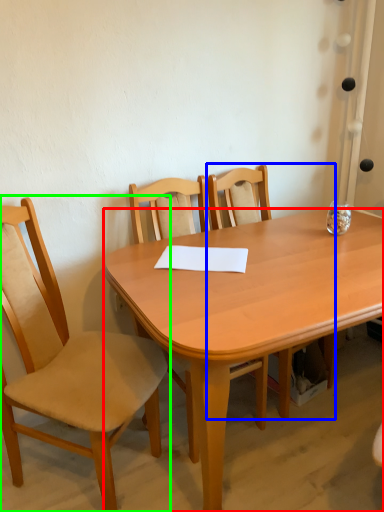
Question: Which is nearer to the desk (highlighted by a red box)? chair (highlighted by a blue box) or chair (highlighted by a green box).

Choices:
 (A) chair
 (B) chair

Answer: (B)